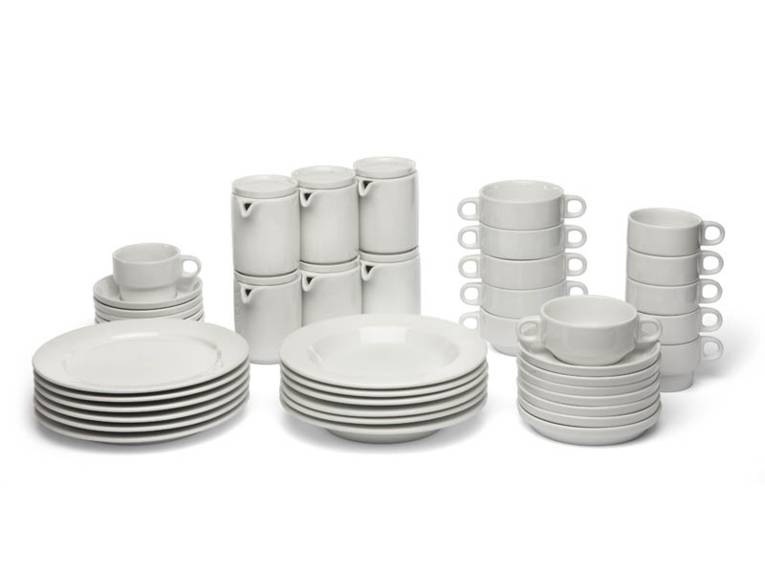
You are a GUI agent. You are given a task and a screenshot of the screen. Output one action in this format:
    pyautogui.click(x=<x>, y=<y>)
    Task: Click on the pitcher
    This screenshot has height=574, width=765.
    Given the screenshot: What is the action you would take?
    pyautogui.click(x=269, y=243), pyautogui.click(x=269, y=318), pyautogui.click(x=337, y=219), pyautogui.click(x=337, y=288), pyautogui.click(x=389, y=203), pyautogui.click(x=392, y=281)